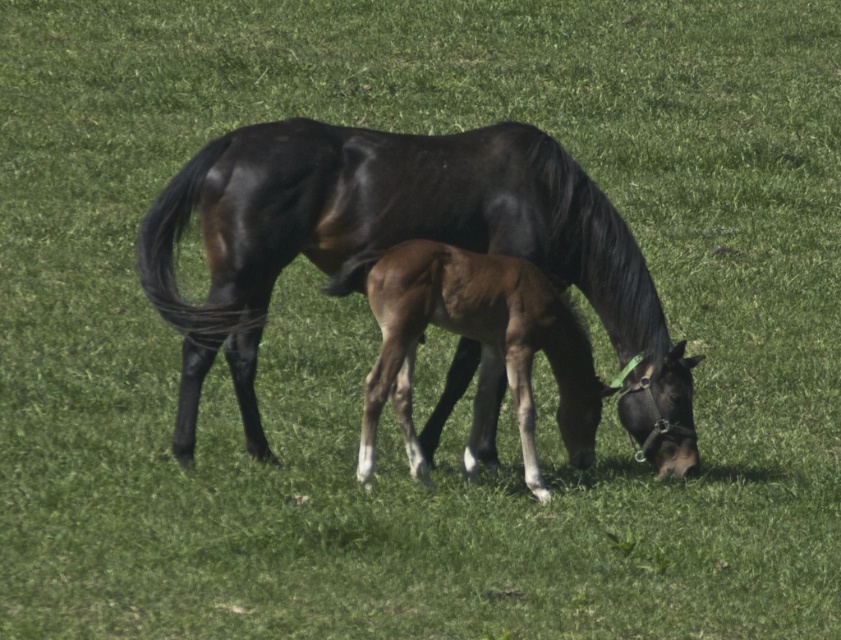
You are a photographer trying to capture both the shiny black horse at center and the brown glossy foal at center in a single frame. Based on their positions, which horse should you focus on first to ensure both are in the shot?

The shiny black horse at center is above the brown glossy foal at center, so you should focus on the shiny black horse at center first to ensure both are in the shot.

You are a farmer who needs to separate the shiny black horse at center and the brown glossy foal at center into two stalls. Since the stalls are different sizes, which horse should go into the larger stall?

The shiny black horse at center is bigger than the brown glossy foal at center, so the larger stall should accommodate the shiny black horse at center.

You are a farmer checking the pasture. You notice the shiny black horse at center and the brown glossy foal at center. Which one is taller?

The shiny black horse at center is taller than the brown glossy foal at center.